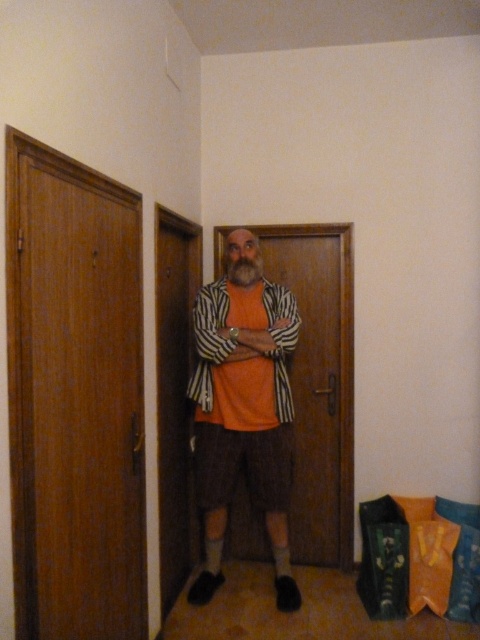
Question: Is orange matte shirt at center bigger than gray/woolly beard at center?

Choices:
 (A) no
 (B) yes

Answer: (B)

Question: Is orange cotton shirt at center to the right of gray/woolly beard at center from the viewer's perspective?

Choices:
 (A) yes
 (B) no

Answer: (B)

Question: Which of the following is the closest to the observer?

Choices:
 (A) wooden door at left
 (B) wooden door at center
 (C) orange cotton shirt at center
 (D) gray/woolly beard at center

Answer: (A)

Question: Estimate the real-world distances between objects in this image. Which object is closer to the wooden door at center?

Choices:
 (A) orange matte shirt at center
 (B) orange cotton shirt at center

Answer: (B)

Question: Is orange cotton shirt at center positioned in front of wooden door at center?

Choices:
 (A) no
 (B) yes

Answer: (B)

Question: Which point is closer to the camera?

Choices:
 (A) (349, 369)
 (B) (140, 611)

Answer: (B)